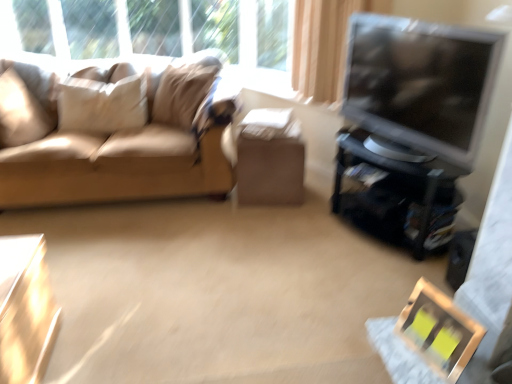
Question: Would you say smooth beige carpet at center is to the left or to the right of beige fabric pillow at upper left, positioned as the second pillow in right-to-left order, in the picture?

Choices:
 (A) left
 (B) right

Answer: (B)

Question: From a real-world perspective, is smooth beige carpet at center above or below beige fabric pillow at upper left, the second pillow positioned from the left?

Choices:
 (A) below
 (B) above

Answer: (A)

Question: Which is nearer to the matte black tv at right?

Choices:
 (A) beige fabric pillow at upper left, which is the 3th pillow from left to right
 (B) beige leather couch at left
 (C) suede beige pillow at left, the third pillow positioned from the right
 (D) smooth beige carpet at center
 (E) matte black tv stand at right

Answer: (E)

Question: Based on their relative distances, which object is farther from the beige fabric pillow at upper left, the second pillow positioned from the left?

Choices:
 (A) wooden picture frame at lower right
 (B) matte cardboard box at center, placed as the first table when sorted from top to bottom
 (C) shiny metallic table at lower left, placed as the 1th table when sorted from front to back
 (D) matte black tv at right
 (E) matte black tv stand at right

Answer: (A)